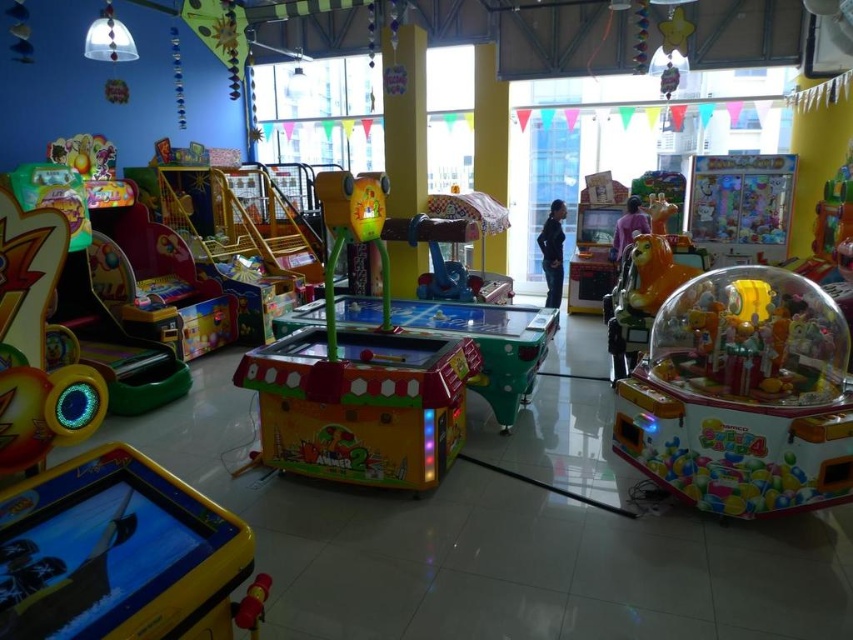
Question: Which object appears closest to the camera in this image?

Choices:
 (A) yellow plastic pirate ship at lower left
 (B) translucent plastic claw machine at right
 (C) black matte pants at center
 (D) matte yellow plastic game at center

Answer: (A)

Question: Which object appears closest to the camera in this image?

Choices:
 (A) matte yellow plastic game at center
 (B) translucent plastic claw machine at right

Answer: (B)

Question: Which of the following is the farthest from the observer?

Choices:
 (A) translucent plastic claw machine at right
 (B) matte yellow plastic game at center

Answer: (B)

Question: Does translucent plastic claw machine at right have a greater width compared to purple matte jacket at center?

Choices:
 (A) no
 (B) yes

Answer: (B)

Question: Is translucent plastic claw machine at right above purple matte jacket at center?

Choices:
 (A) no
 (B) yes

Answer: (A)

Question: Can you confirm if matte yellow plastic game at center is smaller than black matte pants at center?

Choices:
 (A) yes
 (B) no

Answer: (B)